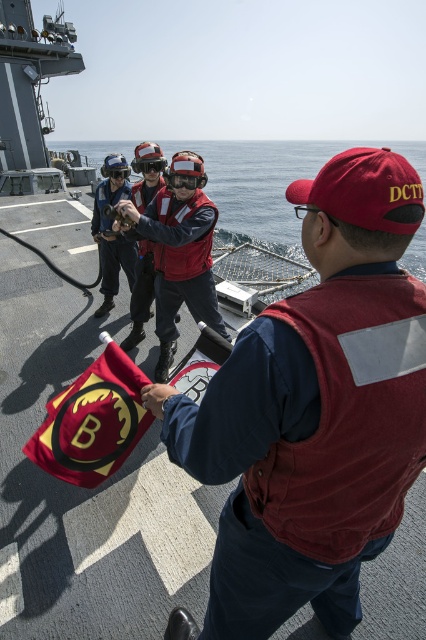
You are a sailor on deck and need to retrieve an item that fell into the blue water at center. The red fabric flag at center is in your way. Can you move around the flag to reach the water?

The blue water at center is located above the red fabric flag at center, so you can move around the flag to access the water since it is positioned below.

Based on the photo, you are standing at the point marked by coordinates point (416,262) on a naval ship. A helicopter is approaching the ship and needs to land safely. The landing zone must be clear of all personnel. If you shout to everyone on the deck to move to a safe area 20 meters away from your current position, will the three individuals behind the man with the flag be in the safe zone?

The point (416,262) and viewer are 19.76 meters apart from each other. Since the safe zone requires being 20 meters away, the three individuals behind the man with the flag would not yet be in the safe zone as they are only 19.76 meters away.

You are on a naval ship and need to determine the relative sizes of objects in the scene. Based on the image, which object is wider when comparing the blue water at center and the matte red life vest at center?

The blue water at center is wider than the matte red life vest at center.